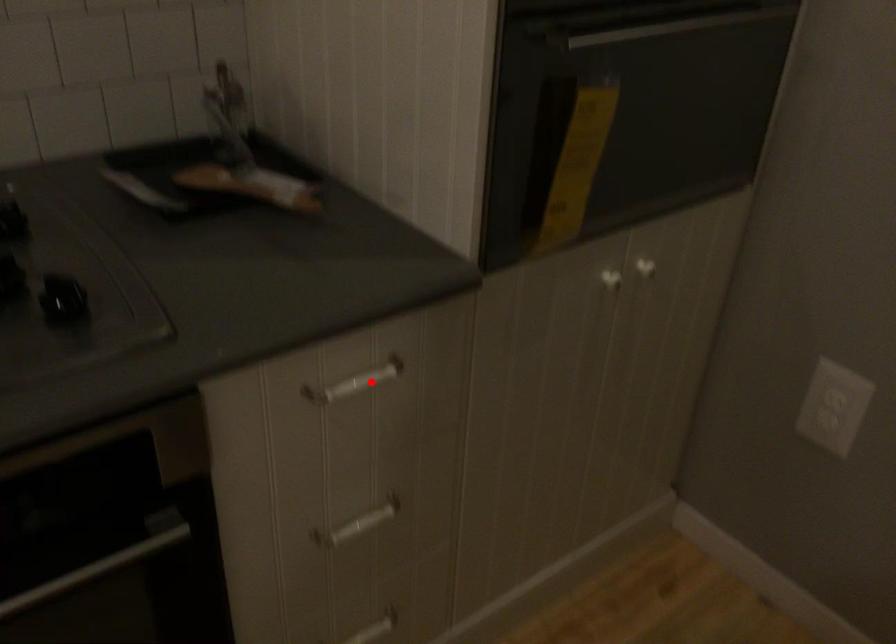
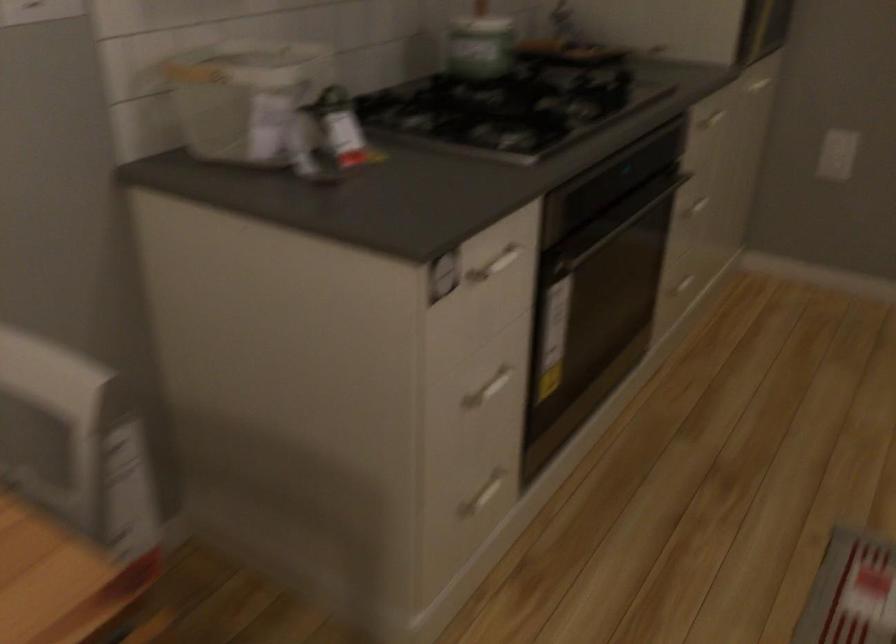
Question: I am providing you with two images of the same scene from different viewpoints. Image1 has a red point marked. In image2, the corresponding 3D location appears at what relative position? Reply with the corresponding letter.

Choices:
 (A) Closer
 (B) Farther

Answer: (B)